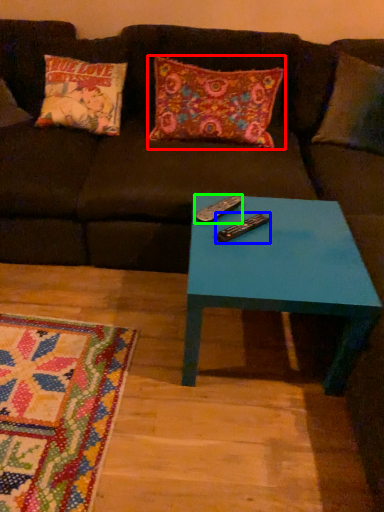
Question: Based on their relative distances, which object is farther from pillow (highlighted by a red box)? Choose from remote (highlighted by a blue box) and remote (highlighted by a green box).

Choices:
 (A) remote
 (B) remote

Answer: (A)